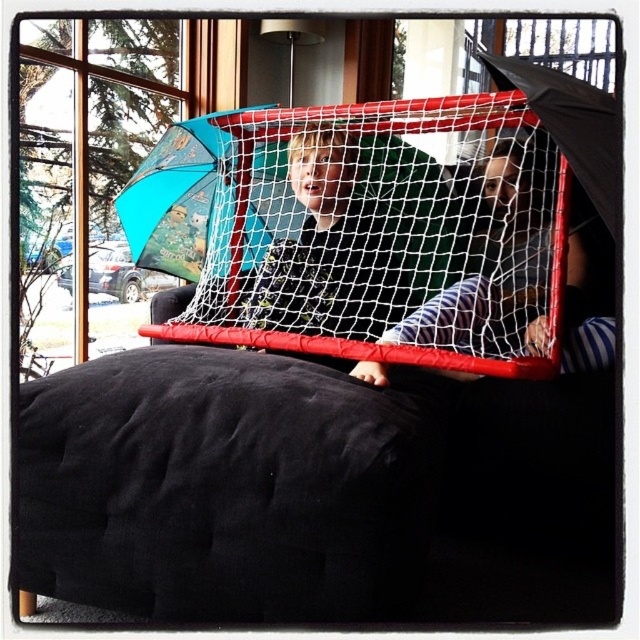
You are a tailor measuring shirts for a customer. You observe both the striped fabric shirt at center and the matte black shirt at center in the image. Which shirt has a greater width according to the description?

The striped fabric shirt at center has a greater width than the matte black shirt at center as stated in the description.

You are a photographer taking a picture of the striped fabric shirt at center and the matte black shirt at center. Which shirt will appear larger in the photo?

The striped fabric shirt at center will appear larger in the photo because it is closer to the viewer than the matte black shirt at center.

You are a photographer setting up for a family photo. You have a blue fabric umbrella at upper left and a matte black shirt at center in your frame. Which object should you adjust to ensure both are fully visible in the photo?

The blue fabric umbrella at upper left is shorter than the matte black shirt at center, so you should adjust the blue fabric umbrella at upper left to ensure it is fully visible in the photo.